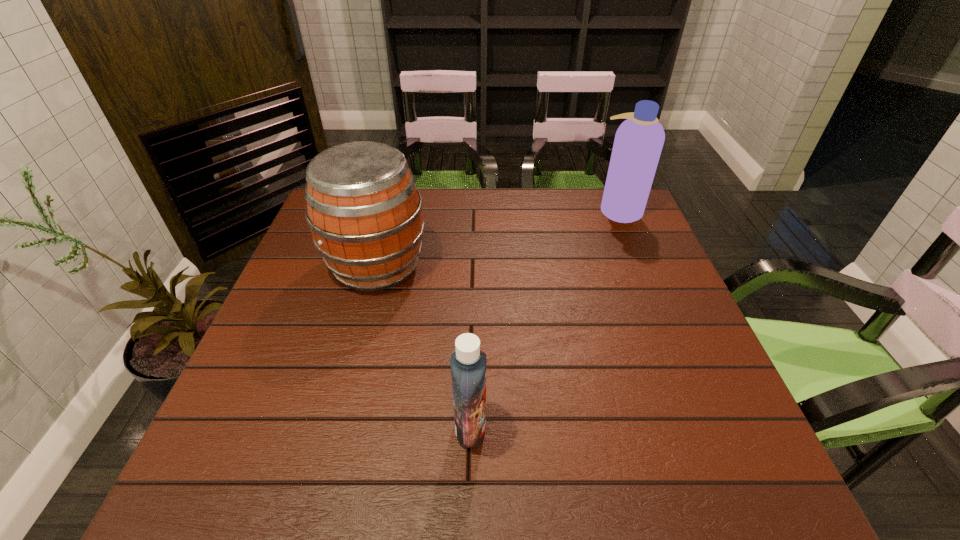
The image size is (960, 540). Identify the location of empty space between the right shampoo and the leftmost object. (x=498, y=238).

This screenshot has height=540, width=960. What are the coordinates of `free spot between the second object from left to right and the second nearest object` in the screenshot? It's located at (423, 346).

You are a GUI agent. You are given a task and a screenshot of the screen. Output one action in this format:
    pyautogui.click(x=<x>, y=<y>)
    Task: Click on the empty space between the left shampoo and the farthest object
    The image size is (960, 540).
    Given the screenshot: What is the action you would take?
    pyautogui.click(x=544, y=318)

What are the coordinates of `free space between the farther shampoo and the shorter shampoo` in the screenshot? It's located at (544, 318).

The width and height of the screenshot is (960, 540). I want to click on free spot between the farthest object and the second nearest object, so click(x=498, y=238).

Identify the location of unoccupied position between the right shampoo and the shortest object. (544, 318).

Where is `free space that is in between the rightmost object and the shortest object`? The width and height of the screenshot is (960, 540). free space that is in between the rightmost object and the shortest object is located at coordinates (544, 318).

Locate an element on the screen. Image resolution: width=960 pixels, height=540 pixels. vacant space that is in between the nearest object and the leftmost object is located at coordinates (423, 346).

This screenshot has height=540, width=960. Find the location of `vacant space in between the farther shampoo and the cider`. vacant space in between the farther shampoo and the cider is located at coordinates (498, 238).

Identify the location of object that is the second closest to the second object from right to left. (638, 143).